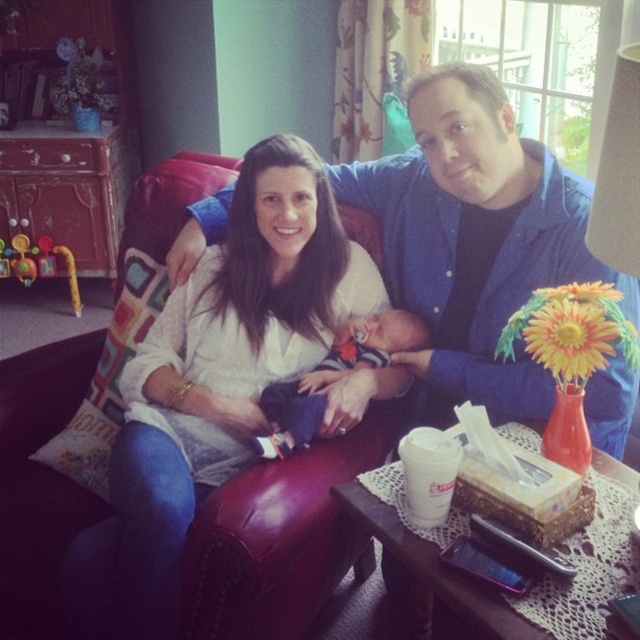
Does white soft fabric at center have a smaller size compared to soft blue fabric newborn at center?

No, white soft fabric at center is not smaller than soft blue fabric newborn at center.

Can you confirm if white soft fabric at center is wider than soft blue fabric newborn at center?

Yes, white soft fabric at center is wider than soft blue fabric newborn at center.

Image resolution: width=640 pixels, height=640 pixels. I want to click on white soft fabric at center, so click(211, 385).